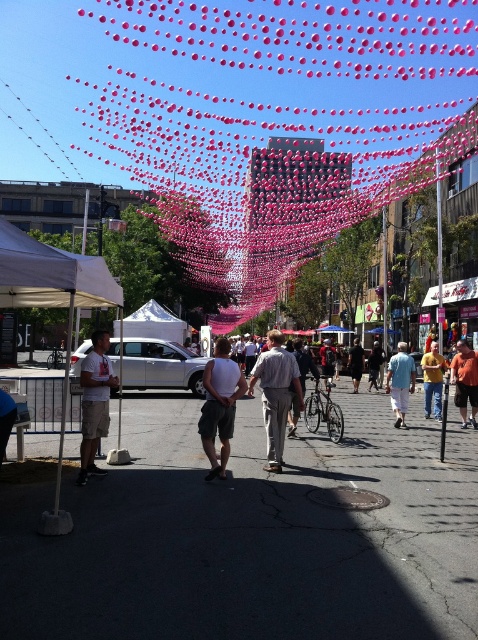
You are standing at the center of the street and want to take a photo of the light gray cotton shirt at center. Where should you position yourself to capture the shirt in the frame?

The light gray cotton shirt at center is located at point 0.616 on the horizontal axis and 0.577 on the vertical axis, so you should position yourself directly facing the shirt at those coordinates to capture it in the frame.

You are standing at the center of the street and want to take a photo of the dark gray fabric pants at center. Which direction should you move to get a better angle?

The dark gray fabric pants at center are located at point (356, 364), so moving slightly to the right might provide a better angle for the photo.